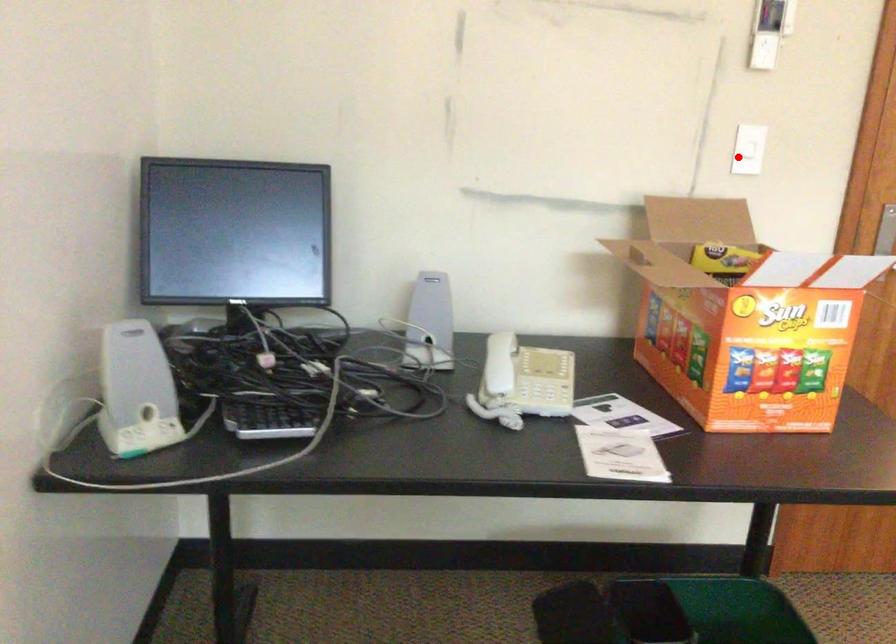
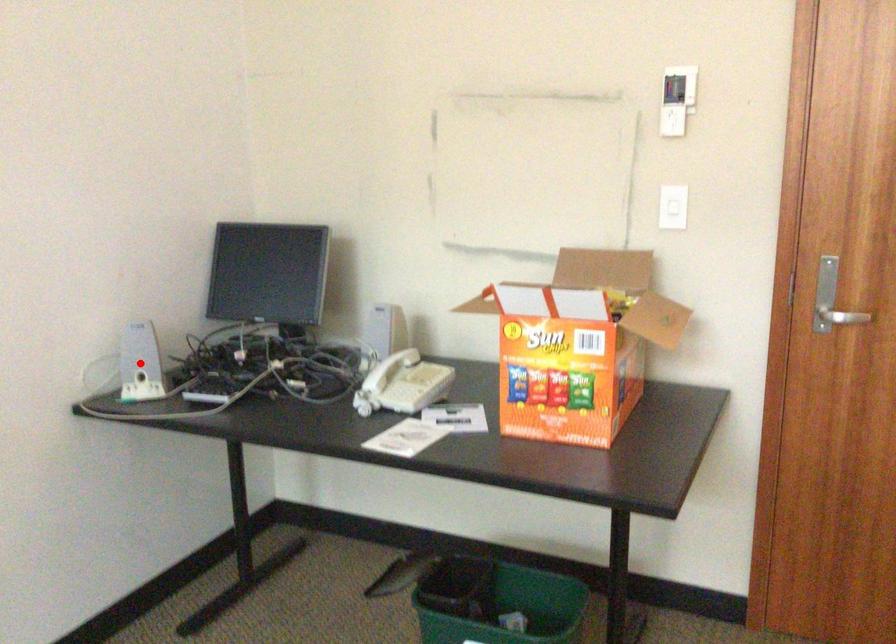
I am providing you with two images of the same scene from different viewpoints. A red point is marked on the first image and another point is marked on the second image. Are the points marked in image1 and image2 representing the same 3D position?

No